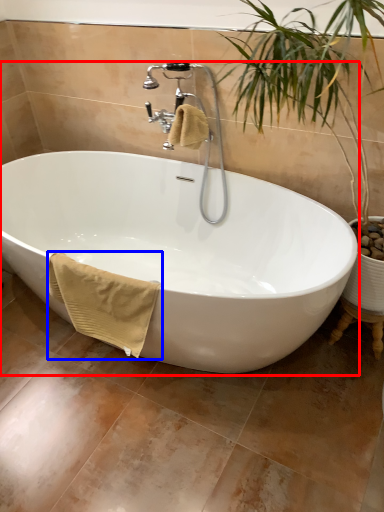
Question: Which object appears closest to the camera in this image, bathtub (highlighted by a red box) or bath towel (highlighted by a blue box)?

Choices:
 (A) bathtub
 (B) bath towel

Answer: (A)